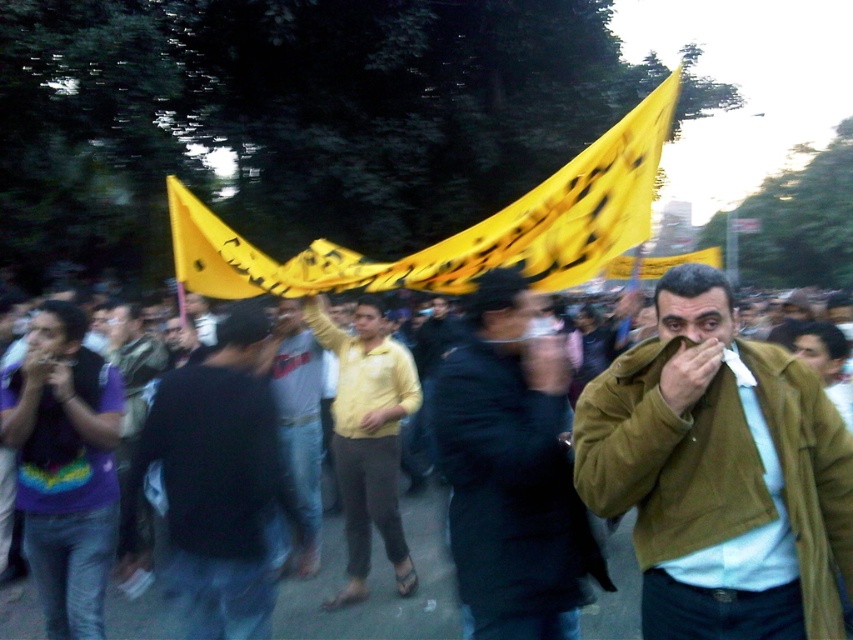
Which is above, yellow fabric banner at center or light gray cotton shirt at center?

light gray cotton shirt at center

At what (x,y) coordinates should I click in order to perform the action: click on yellow fabric banner at center. Please return your answer as a coordinate pair (x, y). This screenshot has width=853, height=640. Looking at the image, I should click on (378, 586).

From the picture: Can you confirm if yellow matte shirt at center is taller than light gray cotton shirt at center?

Yes, yellow matte shirt at center is taller than light gray cotton shirt at center.

Who is more forward, (395, 516) or (287, 336)?

Point (395, 516) is more forward.

What are the coordinates of `yellow matte shirt at center` in the screenshot? It's located at (367, 438).

Is point (804, 604) positioned in front of point (303, 534)?

Yes, point (804, 604) is in front of point (303, 534).

Is point (598, 480) farther from camera compared to point (252, 563)?

No, it is in front of (252, 563).

Find the location of a particular element. This screenshot has width=853, height=640. brown corduroy jacket at center is located at coordinates (720, 474).